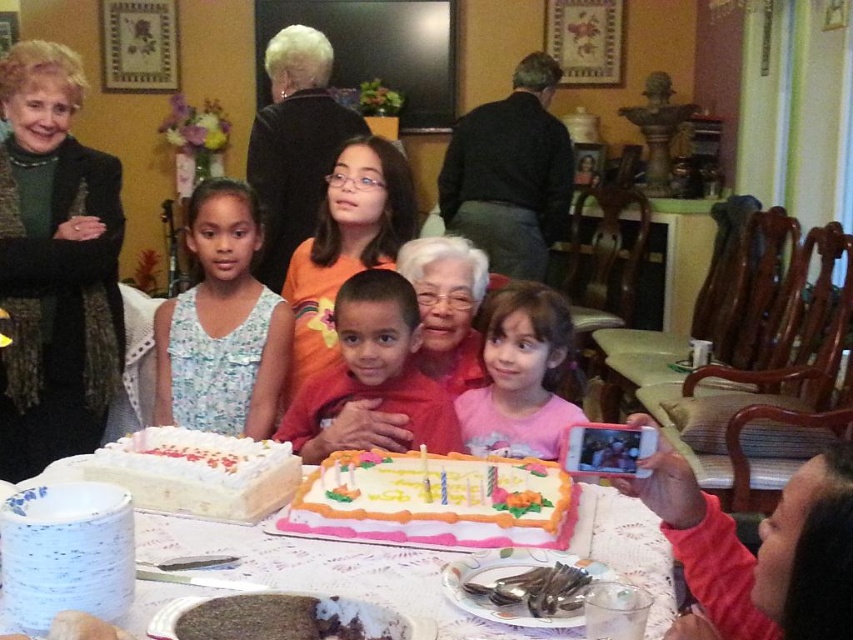
You are standing at the point marked as point (62, 336) and want to reach the dining table in the scene. Can you walk directly to the table without any obstacles?

The point (62, 336) is 2.15 meters away from the viewer, so yes, you can walk directly to the dining table without any obstacles since there are no mentioned obstacles between them.

From the picture: You are organizing a birthday party and need to place the pink fabric phone at lower right and the pink cotton shirt at center on a narrow shelf. Which item can fit better on the shelf if the shelf has limited width?

The pink fabric phone at lower right has a lesser width compared to the pink cotton shirt at center, so it can fit better on the narrow shelf.